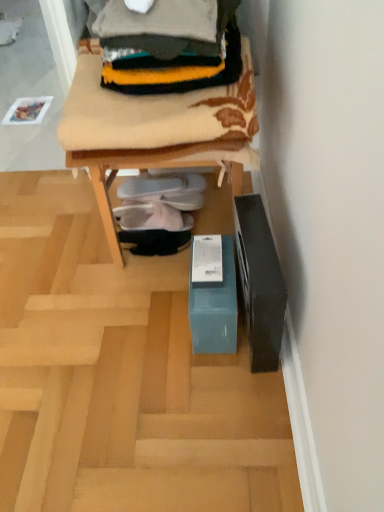
You are a GUI agent. You are given a task and a screenshot of the screen. Output one action in this format:
    pyautogui.click(x=<x>, y=<y>)
    Task: Click on the vacant space in front of white fabric shoe at center, arranged as the second footwear when ordered from the bottom
    The height and width of the screenshot is (512, 384).
    Given the screenshot: What is the action you would take?
    pyautogui.click(x=140, y=271)